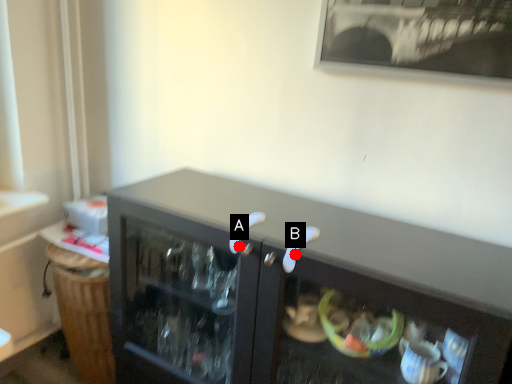
Question: Two points are circled on the image, labeled by A and B beside each circle. Which point appears farthest from the camera in this image?

Choices:
 (A) A is further
 (B) B is further

Answer: (A)